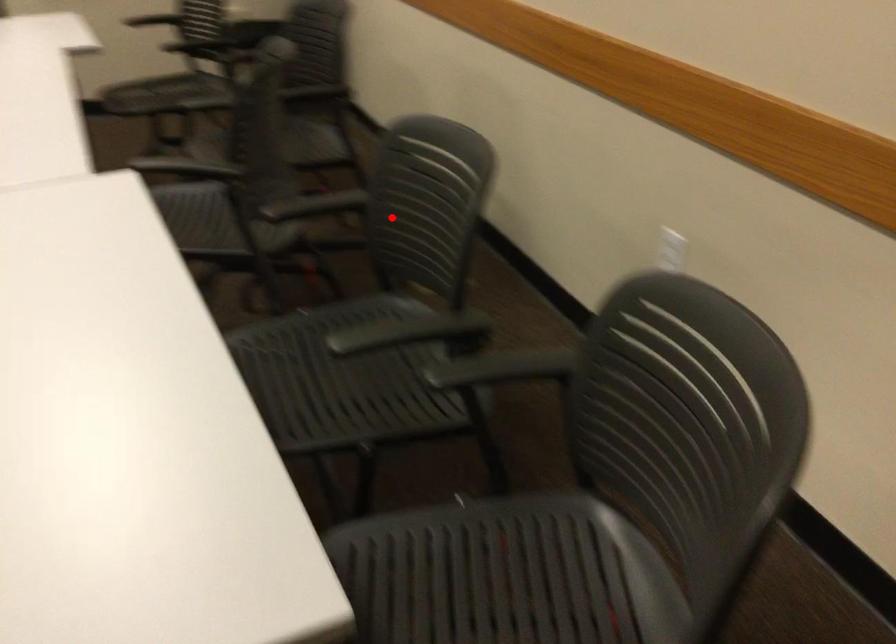
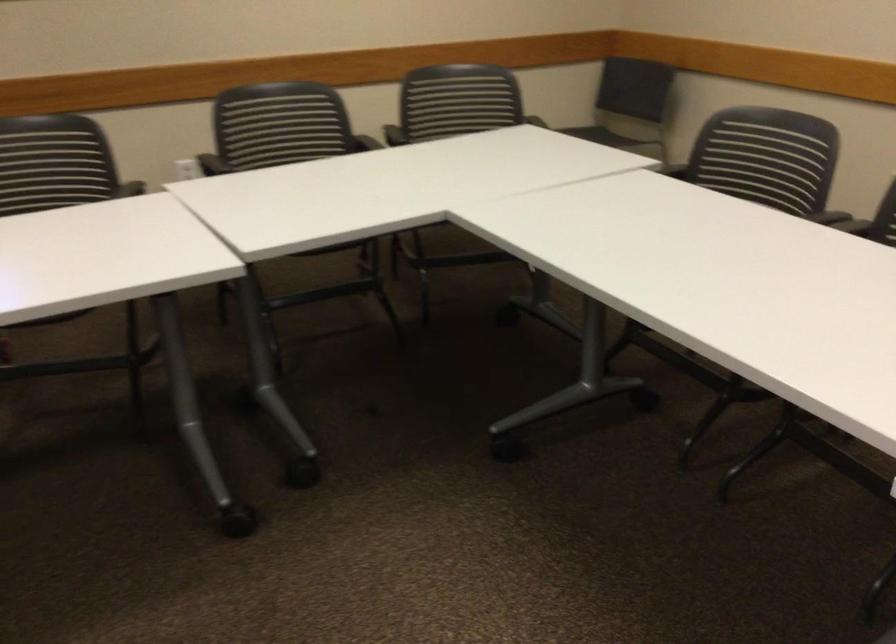
Locate, in the second image, the point that corresponds to the highlighted location in the first image.

(211, 164)